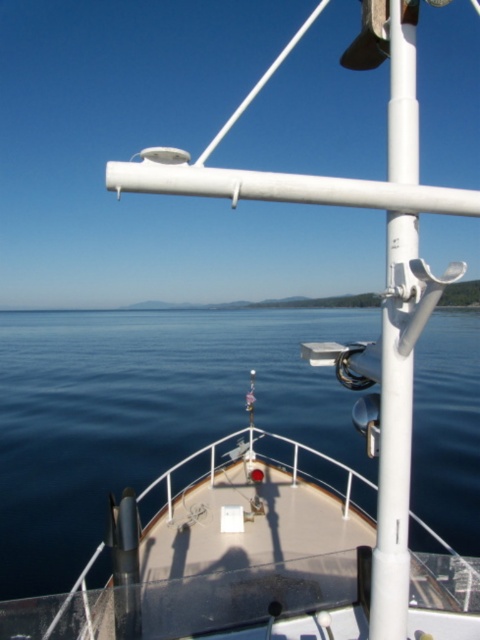
You are standing on the boat deck near the bow and want to locate the blue water at center. According to the coordinates provided, in which direction should you look relative to the boat?

The blue water at center is located at coordinates point [143,412]. Since the coordinates are given without specific axes, but based on typical image coordinate systems where the origin is at the top left corner, the x increases to the right and y increases downward. Therefore, 0.644 on the x would be to the right side, and 0.298 on the y would be lower down from the top. However, since the perspective is from the bow looking forward, the center blue water would be straight ahead towards the horizon. The